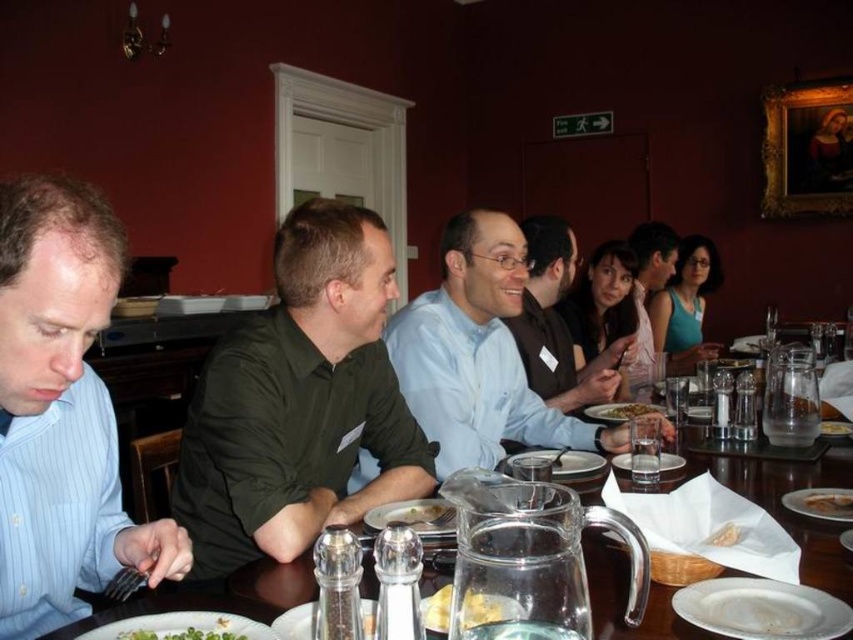
You are a server in a restaurant and need to deliver a drink to the table. The drink needs to be placed between the green matte shirt at center and the green leafy vegetables at center. Can you fit the drink there?

The green matte shirt at center and green leafy vegetables at center are 23.38 inches apart, so yes, the drink can be placed between them as there is sufficient space.

You are a waiter in a restaurant. You need to place a new bowl of soup in the middle of the table where the green matte shirt at center and green leafy vegetables at center are located. Considering their sizes, which object should you move to make space?

The green matte shirt at center is larger in size than the green leafy vegetables at center. Therefore, you should move the green matte shirt at center to make space for the soup bowl.